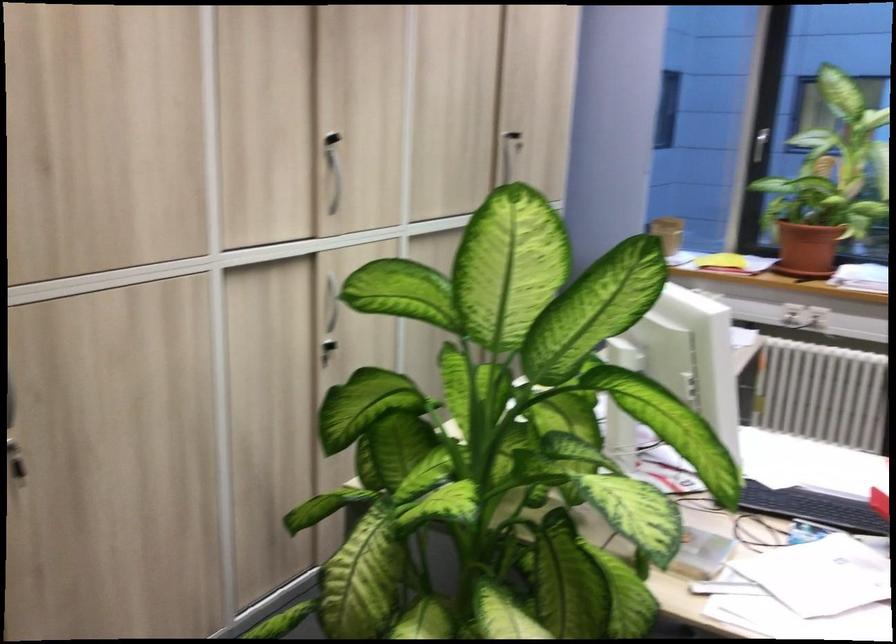
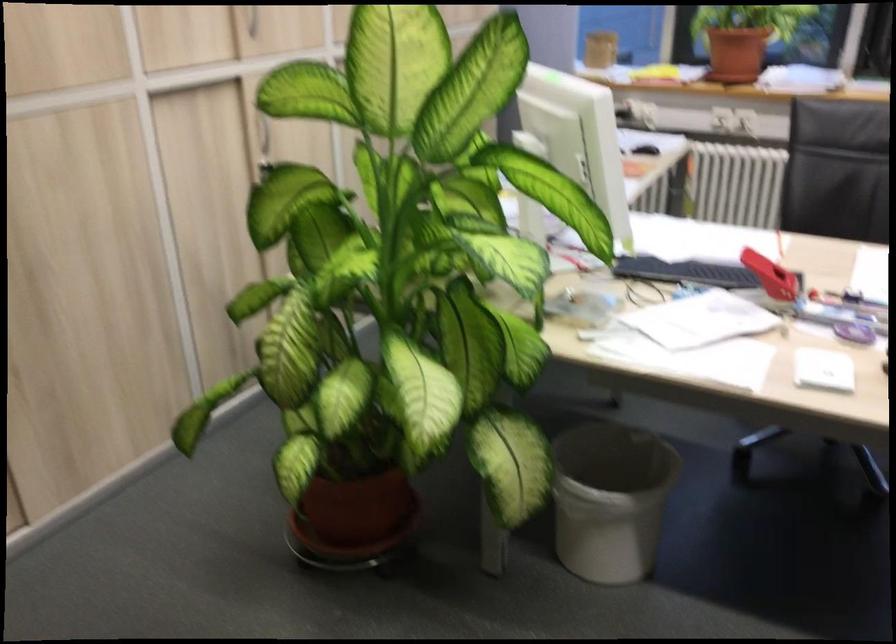
The images are taken continuously from a first-person perspective. In which direction are you moving?

The movement direction of the cameraman is right, backward.